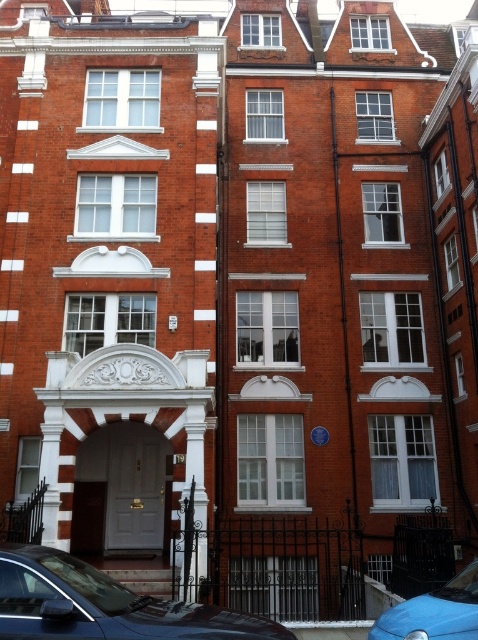
You are a delivery person with a cart that is 2 meters wide. You need to move from the shiny black car at lower left to the blue matte car at lower right. Is there enough space between them to pass through comfortably?

The shiny black car at lower left and blue matte car at lower right are 10.00 meters apart, so yes, there is enough space between them for the delivery person and their 2 meter wide cart to pass through comfortably.

You are a pedestrian standing in front of the entrance of the building. You see the shiny black car at lower left and the blue matte car at lower right. Which car is closer to the entrance?

The shiny black car at lower left is positioned on the left side of blue matte car at lower right. Since the entrance is centrally positioned on the left side of the image, the shiny black car at lower left is closer to the entrance.